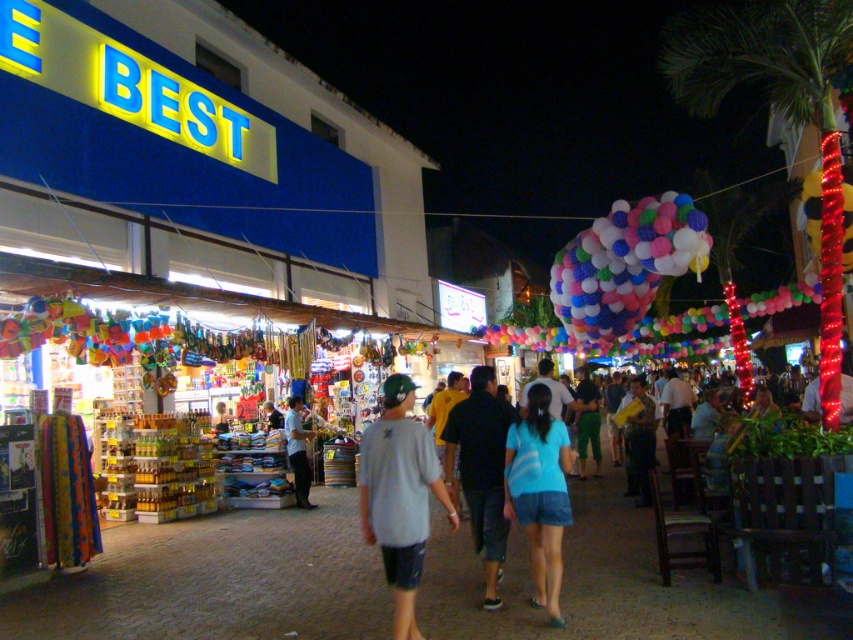
Question: In this image, where is light blue denim shorts at center located relative to multicolored fabric balloons at center?

Choices:
 (A) right
 (B) left

Answer: (B)

Question: Which point is closer to the camera?

Choices:
 (A) (473, 428)
 (B) (630, 225)

Answer: (A)

Question: Can you confirm if gray cotton shirt at center is thinner than blue denim shorts at center?

Choices:
 (A) yes
 (B) no

Answer: (B)

Question: Which point appears farthest from the camera in this image?

Choices:
 (A) (473, 518)
 (B) (376, 515)
 (C) (292, 429)
 (D) (440, 477)

Answer: (C)

Question: Estimate the real-world distances between objects in this image. Which object is closer to the gray cotton shirt at center?

Choices:
 (A) multicolored fabric balloons at center
 (B) blue denim shorts at center
 (C) light blue t-shirt at center

Answer: (B)

Question: Does gray cotton shirt at center come behind blue denim shorts at center?

Choices:
 (A) yes
 (B) no

Answer: (B)